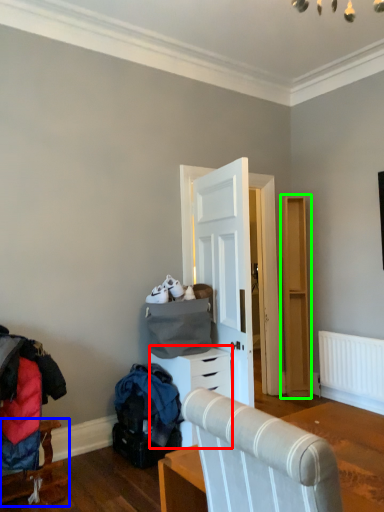
Question: Based on their relative distances, which object is farther from chest of drawers (highlighted by a red box)? Choose from furniture (highlighted by a blue box) and dresser (highlighted by a green box).

Choices:
 (A) furniture
 (B) dresser

Answer: (B)